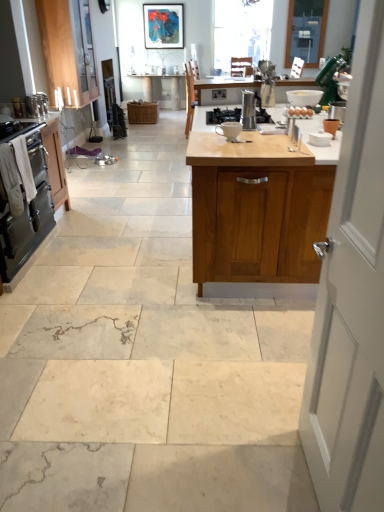
The height and width of the screenshot is (512, 384). Find the location of `free spot to the right of black enamel oven at left`. free spot to the right of black enamel oven at left is located at coordinates (93, 262).